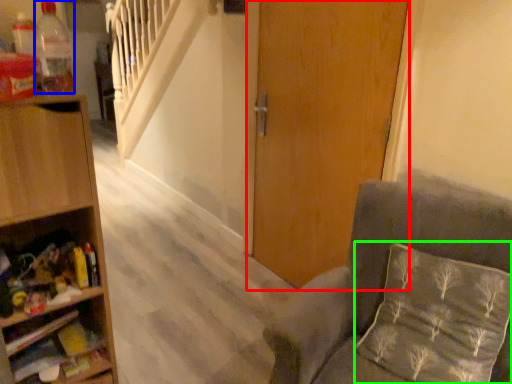
Question: Which object is the farthest from door (highlighted by a red box)? Choose among these: bottle (highlighted by a blue box) or pillow (highlighted by a green box).

Choices:
 (A) bottle
 (B) pillow

Answer: (A)